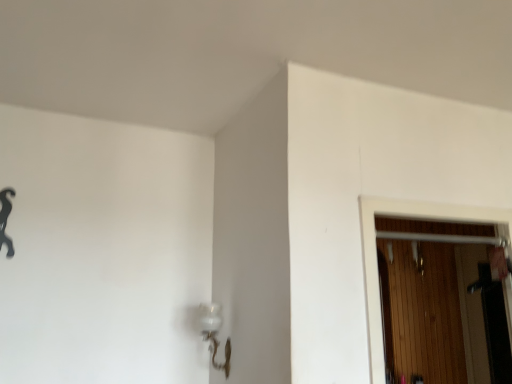
Question: Is wooden at right next to clear glass lamp at lower center and touching it?

Choices:
 (A) no
 (B) yes

Answer: (A)

Question: Could you tell me if wooden at right is facing clear glass lamp at lower center?

Choices:
 (A) yes
 (B) no

Answer: (B)

Question: Considering the relative sizes of wooden at right and clear glass lamp at lower center in the image provided, is wooden at right wider than clear glass lamp at lower center?

Choices:
 (A) yes
 (B) no

Answer: (B)

Question: Can you confirm if wooden at right is positioned to the left of clear glass lamp at lower center?

Choices:
 (A) yes
 (B) no

Answer: (B)

Question: Is wooden at right positioned before clear glass lamp at lower center?

Choices:
 (A) no
 (B) yes

Answer: (B)

Question: Is there a large distance between wooden at right and clear glass lamp at lower center?

Choices:
 (A) yes
 (B) no

Answer: (A)

Question: Are black matte hook at upper left and wooden at right beside each other?

Choices:
 (A) yes
 (B) no

Answer: (B)

Question: Is black matte hook at upper left far away from wooden at right?

Choices:
 (A) yes
 (B) no

Answer: (A)

Question: Does black matte hook at upper left appear on the right side of wooden at right?

Choices:
 (A) yes
 (B) no

Answer: (B)

Question: Does black matte hook at upper left appear on the left side of wooden at right?

Choices:
 (A) yes
 (B) no

Answer: (A)

Question: Is black matte hook at upper left taller than wooden at right?

Choices:
 (A) yes
 (B) no

Answer: (B)

Question: Considering the relative sizes of black matte hook at upper left and wooden at right in the image provided, is black matte hook at upper left bigger than wooden at right?

Choices:
 (A) yes
 (B) no

Answer: (B)

Question: Can you see clear glass lamp at lower center touching wooden at right?

Choices:
 (A) no
 (B) yes

Answer: (A)